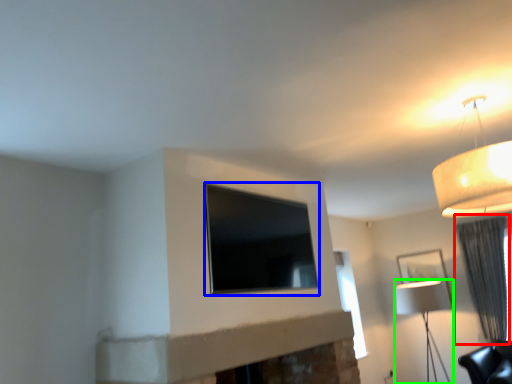
Question: Which is farther away from curtain (highlighted by a red box)? window (highlighted by a blue box) or lamp (highlighted by a green box)?

Choices:
 (A) window
 (B) lamp

Answer: (A)